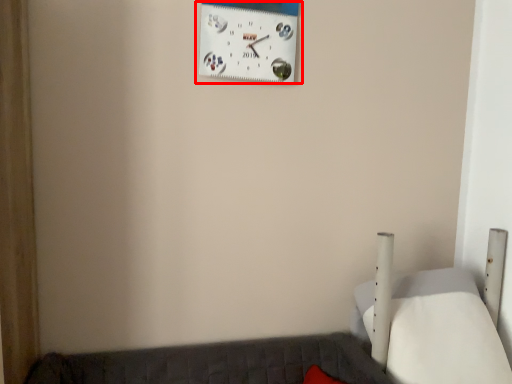
Question: From the image's perspective, considering the relative positions of wall clock (annotated by the red box) and furniture in the image provided, where is wall clock (annotated by the red box) located with respect to the staircase?

Choices:
 (A) below
 (B) above

Answer: (B)